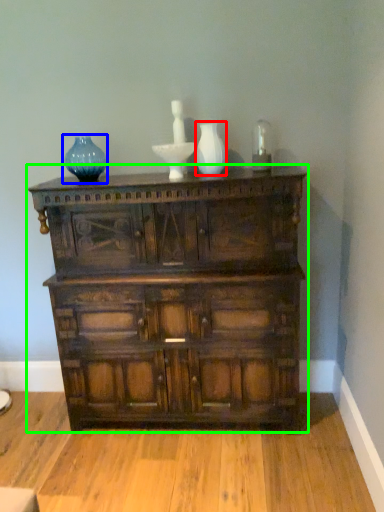
Question: Which object is positioned farthest from glass vase (highlighted by a red box)? Select from vase (highlighted by a blue box) and chest of drawers (highlighted by a green box).

Choices:
 (A) vase
 (B) chest of drawers

Answer: (B)